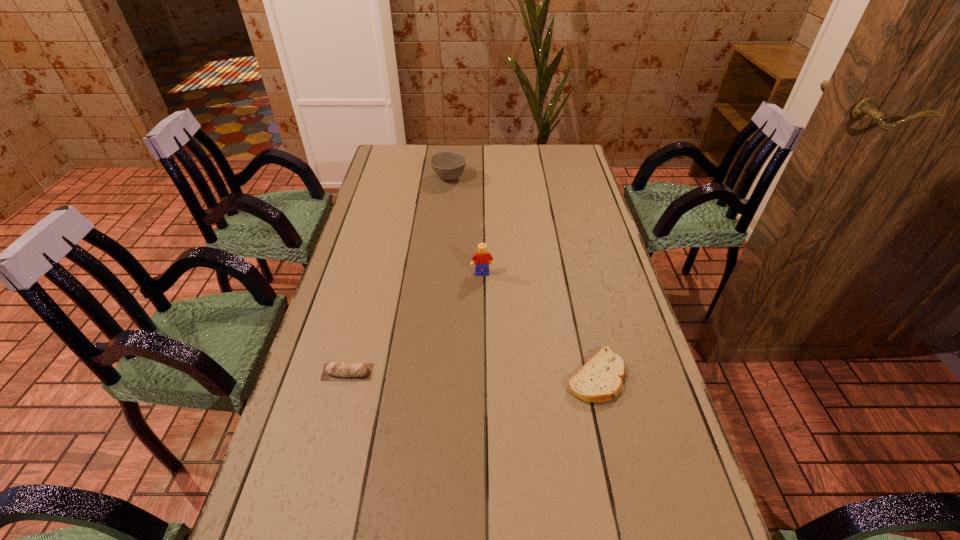
The height and width of the screenshot is (540, 960). What are the coordinates of `vacant space that's between the third object from right to left and the leftmost object` in the screenshot? It's located at (398, 275).

The width and height of the screenshot is (960, 540). I want to click on unoccupied position between the left pita bread and the rightmost object, so click(471, 374).

In order to click on free spot between the farthest object and the tallest object in this screenshot , I will do `click(466, 226)`.

Locate an element on the screen. This screenshot has height=540, width=960. vacant area between the third shortest object and the shortest object is located at coordinates (522, 277).

Find the location of `unoccupied position between the leftmost object and the rightmost object`. unoccupied position between the leftmost object and the rightmost object is located at coordinates (471, 374).

I want to click on free space that is in between the second object from left to right and the second object from right to left, so click(466, 226).

In order to click on vacant area between the third nearest object and the left pita bread in this screenshot , I will do `click(415, 323)`.

The width and height of the screenshot is (960, 540). In order to click on free point between the right pita bread and the third object from right to left in this screenshot , I will do `click(522, 277)`.

The width and height of the screenshot is (960, 540). In order to click on object that is the closest to the Lego in this screenshot , I will do point(601,378).

Locate which object is the second closest to the third nearest object. Please provide its 2D coordinates. Your answer should be formatted as a tuple, i.e. [(x, y)], where the tuple contains the x and y coordinates of a point satisfying the conditions above.

[(348, 371)]